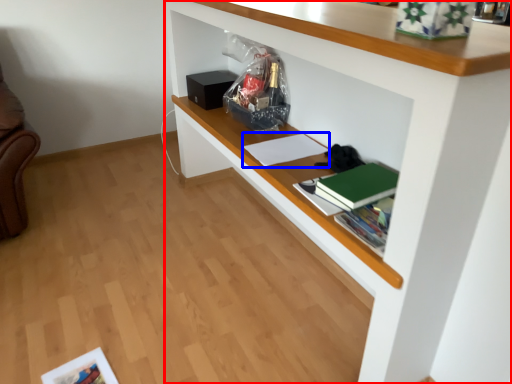
Question: Which of the following is the farthest to the observer, shelf (highlighted by a red box) or book (highlighted by a blue box)?

Choices:
 (A) shelf
 (B) book

Answer: (B)